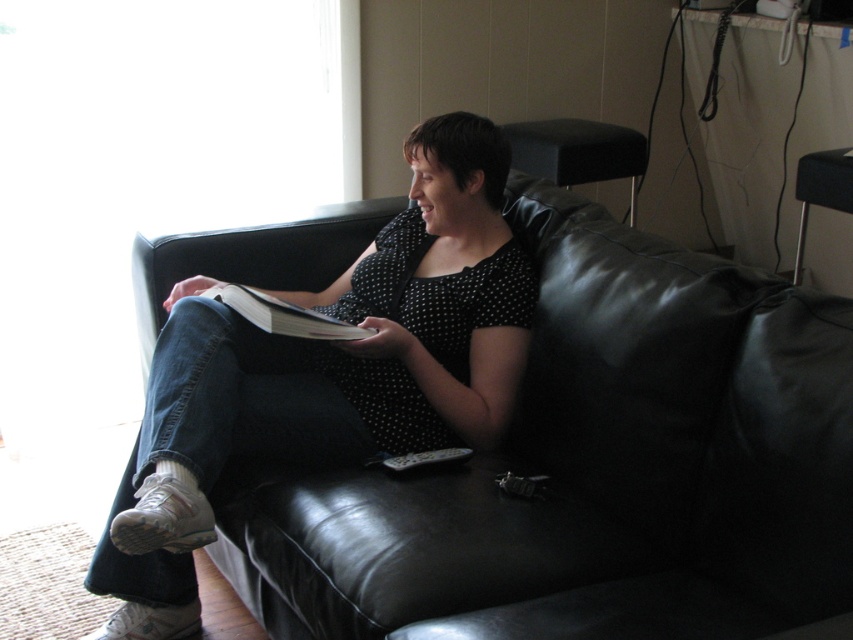
Between black leather couch at center and white paper magazine at center, which one appears on the right side from the viewer's perspective?

From the viewer's perspective, black leather couch at center appears more on the right side.

Is point (556, 538) closer to viewer compared to point (244, 288)?

Yes, it is.

You are a GUI agent. You are given a task and a screenshot of the screen. Output one action in this format:
    pyautogui.click(x=<x>, y=<y>)
    Task: Click on the black leather couch at center
    This screenshot has height=640, width=853.
    Given the screenshot: What is the action you would take?
    pyautogui.click(x=595, y=468)